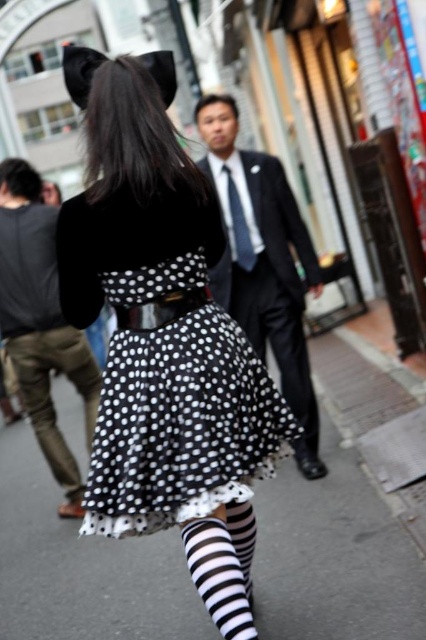
Can you confirm if black polka dot skirt at center is bigger than black satin skirt at center?

Yes, black polka dot skirt at center is bigger than black satin skirt at center.

The height and width of the screenshot is (640, 426). Find the location of `black polka dot skirt at center`. black polka dot skirt at center is located at coordinates (51, 396).

This screenshot has width=426, height=640. Identify the location of black polka dot skirt at center. (51, 396).

Between point (54, 444) and point (209, 593), which one is positioned in front?

Positioned in front is point (209, 593).

Consider the image. Does black polka dot skirt at center appear on the right side of black and white striped socks at lower center?

No, black polka dot skirt at center is not to the right of black and white striped socks at lower center.

This screenshot has height=640, width=426. Describe the element at coordinates (51, 396) in the screenshot. I see `black polka dot skirt at center` at that location.

This screenshot has height=640, width=426. I want to click on black polka dot skirt at center, so click(x=51, y=396).

Between black velvet dress at center and black suit at center, which one is positioned higher?

black suit at center

Where is `black velvet dress at center`? Image resolution: width=426 pixels, height=640 pixels. black velvet dress at center is located at coordinates (164, 339).